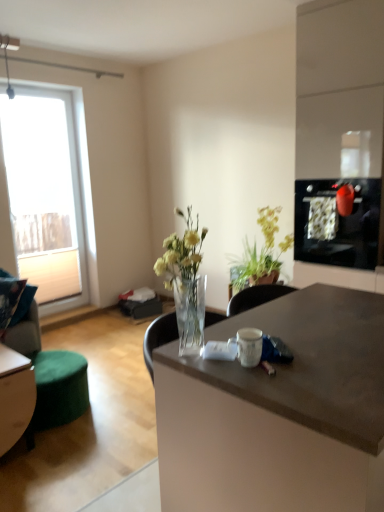
Locate an element on the screen. Image resolution: width=384 pixels, height=512 pixels. blank space situated above green fabric swivel chair at lower left (from a real-world perspective) is located at coordinates (52, 362).